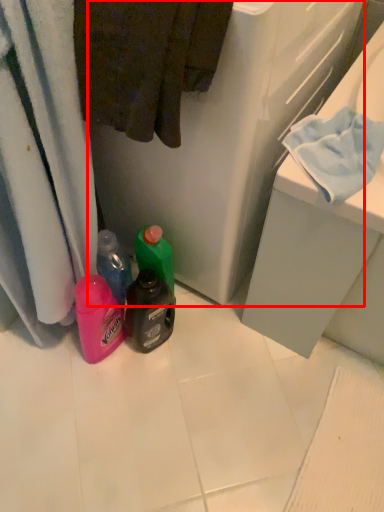
Question: From the image's perspective, where is appliance (annotated by the red box) located in relation to bath towel in the image?

Choices:
 (A) above
 (B) below

Answer: (A)